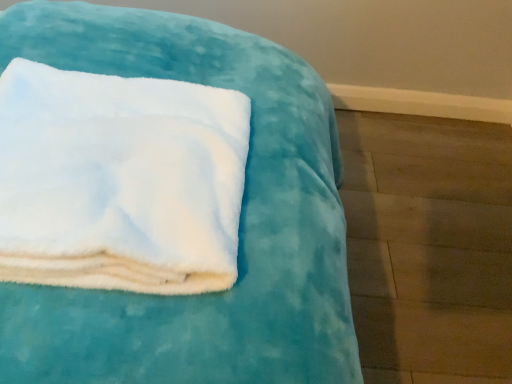
What do you see at coordinates (119, 181) in the screenshot?
I see `white fluffy towel at upper left` at bounding box center [119, 181].

The height and width of the screenshot is (384, 512). I want to click on white fluffy towel at upper left, so click(119, 181).

The image size is (512, 384). I want to click on white fluffy towel at upper left, so click(x=239, y=223).

The height and width of the screenshot is (384, 512). Describe the element at coordinates (239, 223) in the screenshot. I see `white fluffy towel at upper left` at that location.

Where is `white fluffy towel at upper left`? white fluffy towel at upper left is located at coordinates [119, 181].

Does white fluffy towel at upper left appear on the left side of white fluffy towel at upper left?

In fact, white fluffy towel at upper left is to the right of white fluffy towel at upper left.

Which object is closer to the camera taking this photo, white fluffy towel at upper left or white fluffy towel at upper left?

white fluffy towel at upper left is in front.

Which point is more distant from viewer, (256, 315) or (120, 98)?

Point (120, 98)

From the image's perspective, would you say white fluffy towel at upper left is shown under white fluffy towel at upper left?

Yes, from the image's perspective, white fluffy towel at upper left is below white fluffy towel at upper left.

Based on the photo, from a real-world perspective, does white fluffy towel at upper left stand above white fluffy towel at upper left?

No, from a real-world perspective, white fluffy towel at upper left is not over white fluffy towel at upper left

Can you confirm if white fluffy towel at upper left is wider than white fluffy towel at upper left?

Yes, white fluffy towel at upper left is wider than white fluffy towel at upper left.

Who is shorter, white fluffy towel at upper left or white fluffy towel at upper left?

With less height is white fluffy towel at upper left.

Considering the relative sizes of white fluffy towel at upper left and white fluffy towel at upper left in the image provided, is white fluffy towel at upper left bigger than white fluffy towel at upper left?

Correct, white fluffy towel at upper left is larger in size than white fluffy towel at upper left.

Is white fluffy towel at upper left positioned beyond the bounds of white fluffy towel at upper left?

Yes, white fluffy towel at upper left is outside of white fluffy towel at upper left.

In the scene shown: Is white fluffy towel at upper left directly adjacent to white fluffy towel at upper left?

No, white fluffy towel at upper left is not next to white fluffy towel at upper left.

Is white fluffy towel at upper left oriented away from white fluffy towel at upper left?

That's not correct — white fluffy towel at upper left is not looking away from white fluffy towel at upper left.

How distant is white fluffy towel at upper left from white fluffy towel at upper left?

12.18 centimeters.

The width and height of the screenshot is (512, 384). Find the location of `furniture behind the white fluffy towel at upper left`. furniture behind the white fluffy towel at upper left is located at coordinates coord(239,223).

Which object is positioned more to the right, white fluffy towel at upper left or white fluffy towel at upper left?

white fluffy towel at upper left is more to the right.

Which object is further away from the camera, white fluffy towel at upper left or white fluffy towel at upper left?

white fluffy towel at upper left.

Does point (150, 121) come in front of point (297, 301)?

No, (150, 121) is behind (297, 301).

From the image's perspective, relative to white fluffy towel at upper left, is white fluffy towel at upper left above or below?

white fluffy towel at upper left is situated higher than white fluffy towel at upper left in the image.

Looking at this image, from a real-world perspective, between white fluffy towel at upper left and white fluffy towel at upper left, who is vertically higher?

white fluffy towel at upper left is physically above.

Considering the sizes of white fluffy towel at upper left and white fluffy towel at upper left in the image, is white fluffy towel at upper left wider or thinner than white fluffy towel at upper left?

Considering their sizes, white fluffy towel at upper left looks slimmer than white fluffy towel at upper left.

Is white fluffy towel at upper left taller or shorter than white fluffy towel at upper left?

Clearly, white fluffy towel at upper left is taller compared to white fluffy towel at upper left.

Which of these two, white fluffy towel at upper left or white fluffy towel at upper left, is smaller?

Smaller between the two is white fluffy towel at upper left.

Would you say white fluffy towel at upper left is inside or outside white fluffy towel at upper left?

white fluffy towel at upper left is located beyond the bounds of white fluffy towel at upper left.

Are white fluffy towel at upper left and white fluffy towel at upper left located far from each other?

white fluffy towel at upper left is actually quite close to white fluffy towel at upper left.

Is white fluffy towel at upper left oriented away from white fluffy towel at upper left?

No, white fluffy towel at upper left is not at the back of white fluffy towel at upper left.

Can you tell me how much white fluffy towel at upper left and white fluffy towel at upper left differ in facing direction?

The angular difference between white fluffy towel at upper left and white fluffy towel at upper left is 179 degrees.

Measure the distance from white fluffy towel at upper left to white fluffy towel at upper left.

They are 4.79 inches apart.

Image resolution: width=512 pixels, height=384 pixels. I want to click on furniture that appears below the white fluffy towel at upper left (from a real-world perspective), so click(x=239, y=223).

You are a GUI agent. You are given a task and a screenshot of the screen. Output one action in this format:
    pyautogui.click(x=<x>, y=<y>)
    Task: Click on the furniture on the right of white fluffy towel at upper left
    The width and height of the screenshot is (512, 384).
    Given the screenshot: What is the action you would take?
    pyautogui.click(x=239, y=223)

The image size is (512, 384). In the image, there is a white fluffy towel at upper left. In order to click on furniture below it (from a real-world perspective) in this screenshot , I will do `click(239, 223)`.